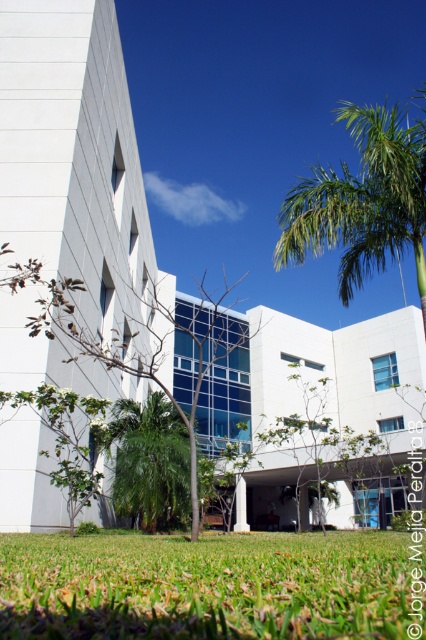
You are a landscape architect planning to plant more trees in the lawn. If you want to maintain the current spacing between the green leafy tree at center and green leafy palm tree at center, which tree should you choose to replicate in terms of width to ensure consistency?

The green leafy tree at center has a greater width than the green leafy palm tree at center. To maintain consistency in spacing, you should replicate the green leafy palm tree at center since it is narrower, ensuring the same spacing between trees.

Based on the scene description, what object is located at the coordinates point (x=115, y=348)?

The green leafy tree at center is located at point (x=115, y=348).